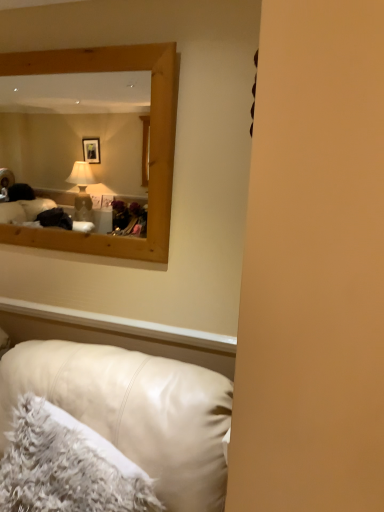
You are a GUI agent. You are given a task and a screenshot of the screen. Output one action in this format:
    pyautogui.click(x=<x>, y=<y>)
    Task: Click on the white fluffy pillow at lower left
    The width and height of the screenshot is (384, 512).
    Given the screenshot: What is the action you would take?
    pyautogui.click(x=63, y=469)

This screenshot has height=512, width=384. What do you see at coordinates (63, 469) in the screenshot? I see `white fluffy pillow at lower left` at bounding box center [63, 469].

Find the location of a particular element. leather couch at lower left is located at coordinates (134, 411).

This screenshot has height=512, width=384. What do you see at coordinates (134, 411) in the screenshot?
I see `leather couch at lower left` at bounding box center [134, 411].

Locate an element on the screen. The image size is (384, 512). white fluffy pillow at lower left is located at coordinates 63,469.

Which is more to the right, leather couch at lower left or white fluffy pillow at lower left?

white fluffy pillow at lower left is more to the right.

Does leather couch at lower left come in front of white fluffy pillow at lower left?

→ Yes, leather couch at lower left is closer to the camera.

Which point is more forward, (4, 383) or (5, 502)?

The point (5, 502) is more forward.

From the image's perspective, who appears lower, leather couch at lower left or white fluffy pillow at lower left?

leather couch at lower left appears lower in the image.

From a real-world perspective, which object stands above the other?

white fluffy pillow at lower left.

Between leather couch at lower left and white fluffy pillow at lower left, which one has larger width?

With larger width is leather couch at lower left.

Is leather couch at lower left taller than white fluffy pillow at lower left?

Indeed, leather couch at lower left has a greater height compared to white fluffy pillow at lower left.

Is leather couch at lower left smaller than white fluffy pillow at lower left?

No, leather couch at lower left is not smaller than white fluffy pillow at lower left.

Is leather couch at lower left positioned beyond the bounds of white fluffy pillow at lower left?

Yes.

Consider the image. Is leather couch at lower left far away from white fluffy pillow at lower left?

No, leather couch at lower left is not far from white fluffy pillow at lower left.

Could you tell me if leather couch at lower left is facing white fluffy pillow at lower left?

Yes, leather couch at lower left is aimed at white fluffy pillow at lower left.

Measure the distance from leather couch at lower left to white fluffy pillow at lower left.

leather couch at lower left and white fluffy pillow at lower left are 15.23 centimeters apart from each other.

In the image, there is a white fluffy pillow at lower left. Find the location of `studio couch below it (from the image's perspective)`. studio couch below it (from the image's perspective) is located at coordinates (134, 411).

Which object is positioned more to the right, white fluffy pillow at lower left or leather couch at lower left?

white fluffy pillow at lower left.

Which object is closer to the camera, white fluffy pillow at lower left or leather couch at lower left?

leather couch at lower left is closer to the camera.

Between point (31, 438) and point (108, 416), which one is positioned behind?

The point (108, 416) is more distant.

From the image's perspective, which one is positioned higher, white fluffy pillow at lower left or leather couch at lower left?

white fluffy pillow at lower left is shown above in the image.

From a real-world perspective, between white fluffy pillow at lower left and leather couch at lower left, who is vertically lower?

leather couch at lower left.

Between white fluffy pillow at lower left and leather couch at lower left, which one has smaller width?

white fluffy pillow at lower left.

Can you confirm if white fluffy pillow at lower left is shorter than leather couch at lower left?

Yes, white fluffy pillow at lower left is shorter than leather couch at lower left.

Is white fluffy pillow at lower left smaller than leather couch at lower left?

Correct, white fluffy pillow at lower left occupies less space than leather couch at lower left.

Would you say white fluffy pillow at lower left is inside or outside leather couch at lower left?

white fluffy pillow at lower left is inside leather couch at lower left.

Are white fluffy pillow at lower left and leather couch at lower left far apart?

white fluffy pillow at lower left is actually quite close to leather couch at lower left.

Is white fluffy pillow at lower left oriented towards leather couch at lower left?

Yes, white fluffy pillow at lower left faces towards leather couch at lower left.

What's the angular difference between white fluffy pillow at lower left and leather couch at lower left's facing directions?

The angle between the facing direction of white fluffy pillow at lower left and the facing direction of leather couch at lower left is 10.6 degrees.

Locate an element on the screen. This screenshot has height=512, width=384. pillow on the right of leather couch at lower left is located at coordinates (63, 469).

The height and width of the screenshot is (512, 384). I want to click on studio couch that appears below the white fluffy pillow at lower left (from a real-world perspective), so click(134, 411).

Locate an element on the screen. This screenshot has width=384, height=512. pillow above the leather couch at lower left (from a real-world perspective) is located at coordinates (63, 469).